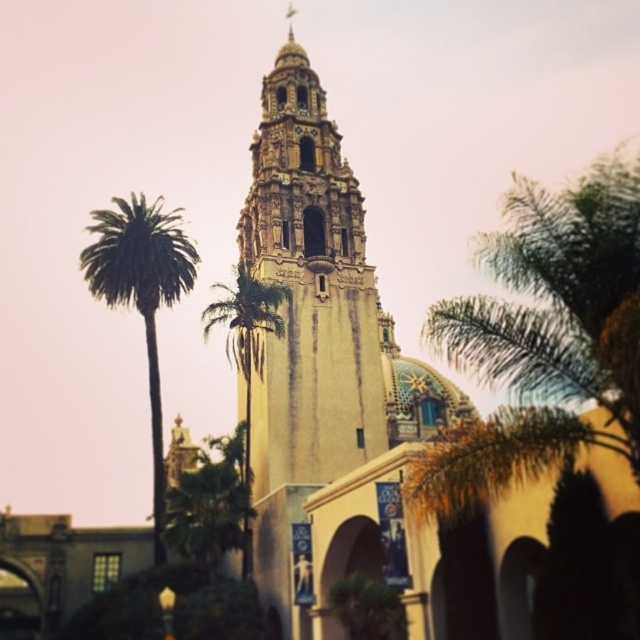
Question: Can you confirm if beige stone bell tower at center is thinner than green leafy palm tree at center?

Choices:
 (A) no
 (B) yes

Answer: (B)

Question: Based on their relative distances, which object is farther from the beige stone bell tower at center?

Choices:
 (A) green leafy palm tree at center
 (B) green leafy palm tree at left

Answer: (B)

Question: In this image, where is green leafy palm tree at left located relative to green leafy palm tree at center?

Choices:
 (A) right
 (B) left

Answer: (B)

Question: Which object is the farthest from the green leafy palm tree at left?

Choices:
 (A) green leafy palm tree at center
 (B) beige stone bell tower at center

Answer: (B)

Question: Which object is closer to the camera taking this photo?

Choices:
 (A) green leafy palm tree at center
 (B) green leafy palm tree at left

Answer: (A)

Question: Can you confirm if beige stone bell tower at center is wider than green leafy palm tree at center?

Choices:
 (A) yes
 (B) no

Answer: (B)